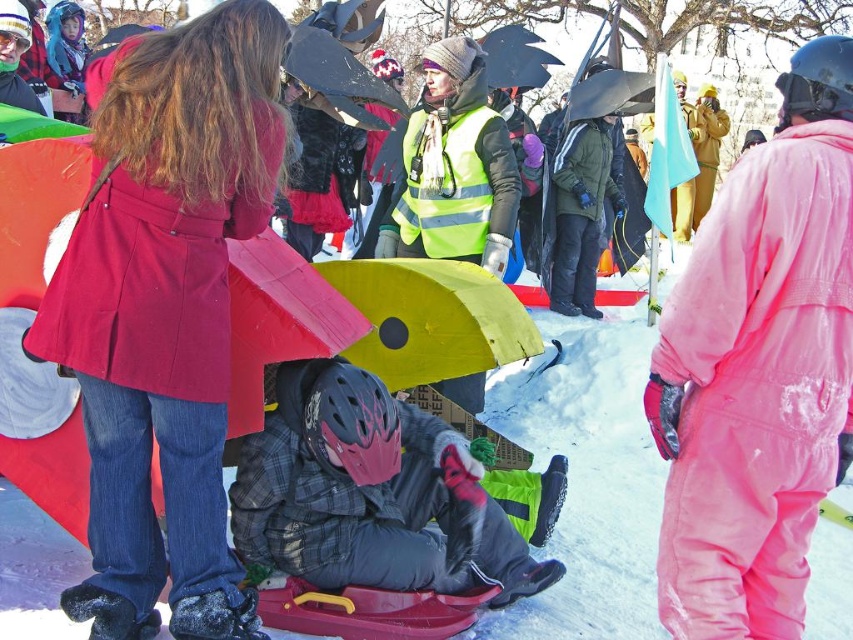
You are a photographer trying to capture the pink snowsuit at right and the white fluffy snow at center in a single shot. Based on their positions, can you ensure both elements will be visible in your photo without moving the camera?

The pink snowsuit at right is above the white fluffy snow at center, so yes, both elements will be visible in the photo as they are positioned vertically apart but within the same frame.

You are a photographer trying to capture the entire scene in one shot. The pink snowsuit at right and the white fluffy snow at center are both important elements. Which object should you focus on first to ensure it isn t cropped out of the frame?

The pink snowsuit at right should be focused on first because it is larger in size than the white fluffy snow at center, making it more prominent and important to capture fully.

You are planning to build a snowman using the white fluffy snow at center and the plaid fabric snowboard at center. Which object should you use as the base of the snowman and why?

You should use the plaid fabric snowboard at center as the base because the white fluffy snow at center is smaller and may not provide enough material for a stable base.